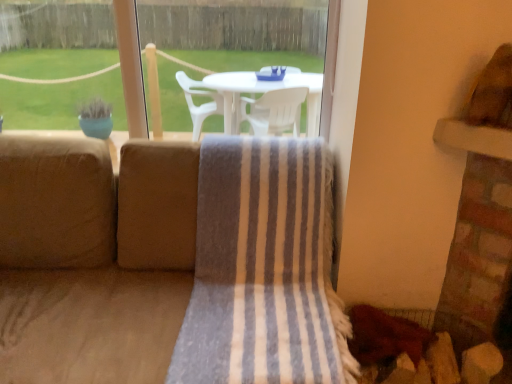
Describe the element at coordinates (261, 269) in the screenshot. This screenshot has height=384, width=512. I see `striped woolen blanket at center` at that location.

The height and width of the screenshot is (384, 512). In order to click on striped woolen blanket at center in this screenshot , I will do `click(261, 269)`.

The height and width of the screenshot is (384, 512). I want to click on striped woolen blanket at center, so click(261, 269).